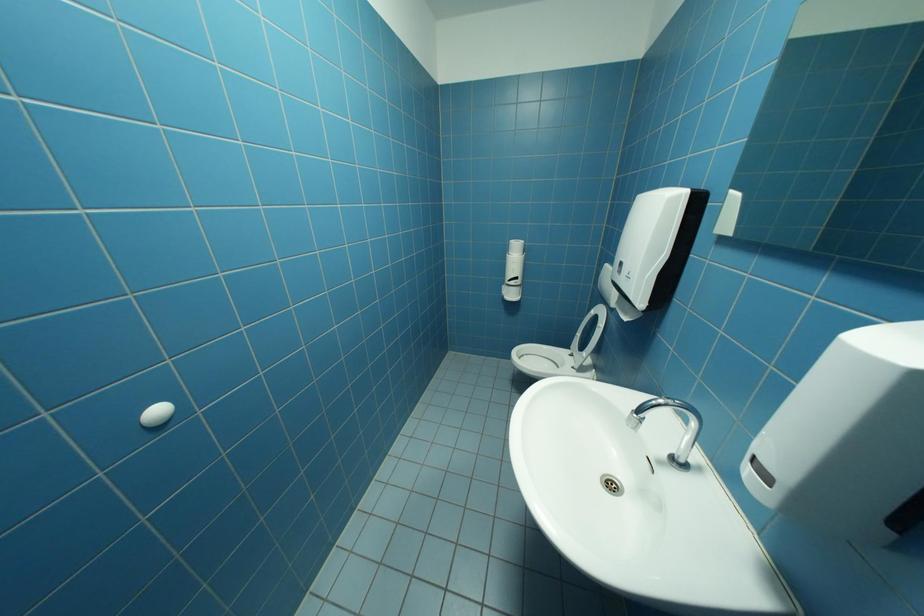
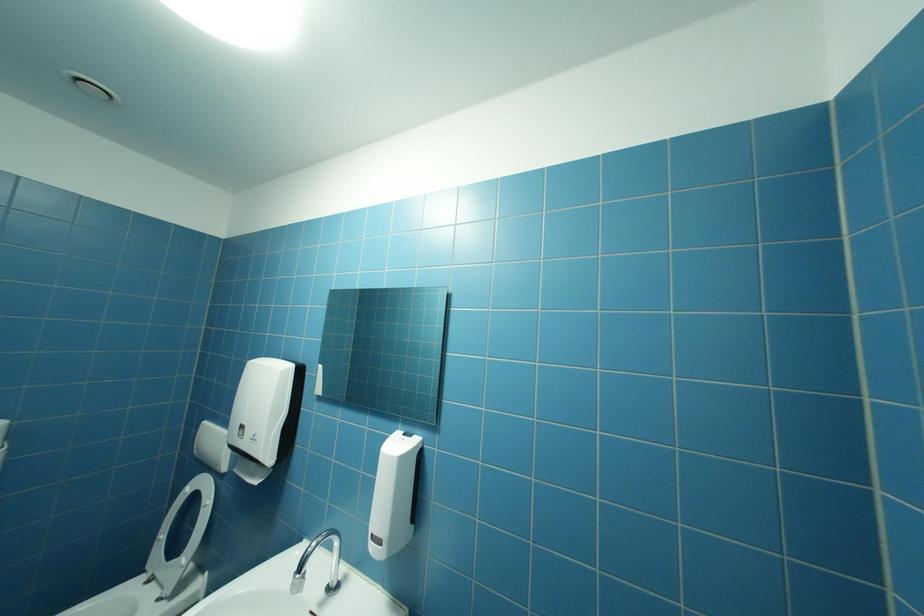
Question: How did the camera likely rotate?

Choices:
 (A) Left
 (B) Right
 (C) Up
 (D) Down

Answer: (B)